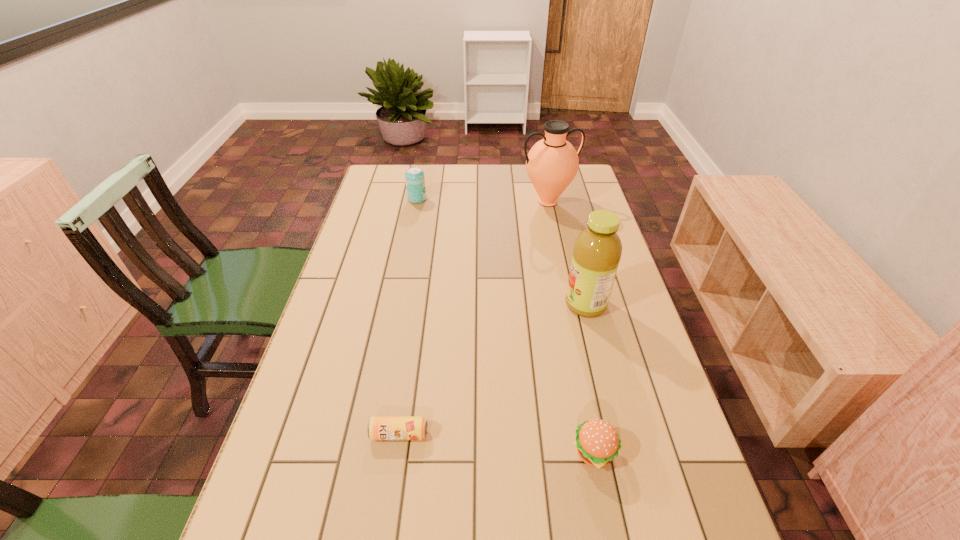
This screenshot has width=960, height=540. What are the coordinates of `pitcher` in the screenshot? It's located at (552, 163).

Find the location of a particular element. This screenshot has height=540, width=960. fruit juice is located at coordinates (597, 250).

You are a GUI agent. You are given a task and a screenshot of the screen. Output one action in this format:
    pyautogui.click(x=<x>, y=<y>)
    Task: Click on the taller beer can
    The width and height of the screenshot is (960, 540).
    Given the screenshot: What is the action you would take?
    click(x=415, y=180)

Locate an element on the screen. The height and width of the screenshot is (540, 960). the third shortest object is located at coordinates (415, 180).

Locate an element on the screen. This screenshot has width=960, height=540. the second shortest object is located at coordinates (597, 442).

Find the location of a particular element. This screenshot has width=960, height=540. the shorter beer can is located at coordinates (379, 428).

What are the coordinates of `the shortest object` in the screenshot? It's located at (379, 428).

This screenshot has height=540, width=960. What are the coordinates of `vacant position located on the front of the pitcher` in the screenshot? It's located at (553, 226).

Where is `free space located 0.100m on the front label of the third farthest object`? free space located 0.100m on the front label of the third farthest object is located at coordinates pyautogui.click(x=529, y=305).

The height and width of the screenshot is (540, 960). I want to click on free location located 0.340m on the front label of the third farthest object, so click(444, 305).